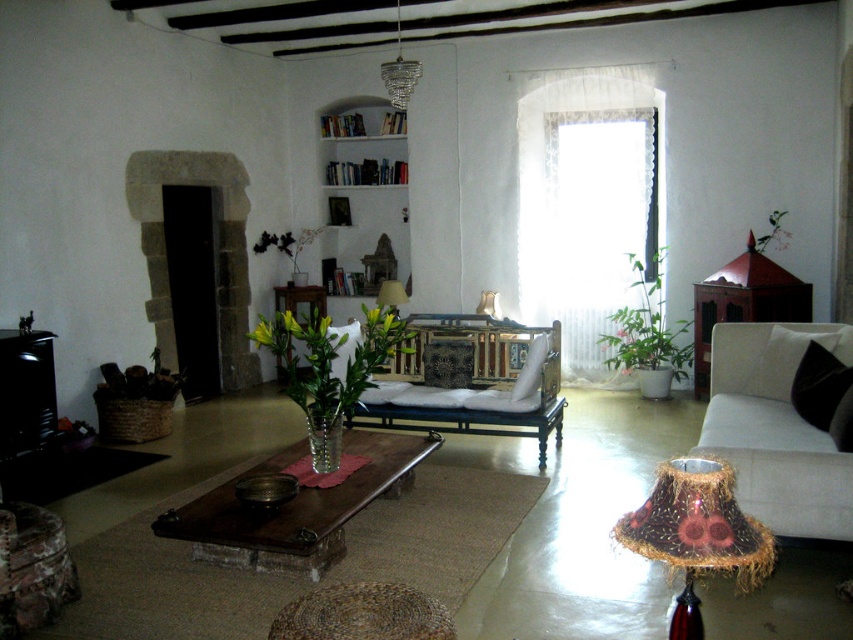
Does beige fabric couch at lower right have a larger size compared to metallic gold lampshade at center?

Correct, beige fabric couch at lower right is larger in size than metallic gold lampshade at center.

Is beige fabric couch at lower right to the right of metallic gold lampshade at center from the viewer's perspective?

Yes, beige fabric couch at lower right is to the right of metallic gold lampshade at center.

What do you see at coordinates (776, 428) in the screenshot?
I see `beige fabric couch at lower right` at bounding box center [776, 428].

The width and height of the screenshot is (853, 640). Find the location of `beige fabric couch at lower right`. beige fabric couch at lower right is located at coordinates (776, 428).

Is beige fabric couch at lower right behind translucent glass table at center?

No, beige fabric couch at lower right is closer to the viewer.

Who is shorter, beige fabric couch at lower right or translucent glass table at center?

Standing shorter between the two is translucent glass table at center.

Does point (779, 465) come in front of point (288, 308)?

Yes, it is in front of point (288, 308).

Where is `beige fabric couch at lower right`? The height and width of the screenshot is (640, 853). beige fabric couch at lower right is located at coordinates (776, 428).

The width and height of the screenshot is (853, 640). Describe the element at coordinates (776, 428) in the screenshot. I see `beige fabric couch at lower right` at that location.

The image size is (853, 640). I want to click on beige fabric couch at lower right, so click(776, 428).